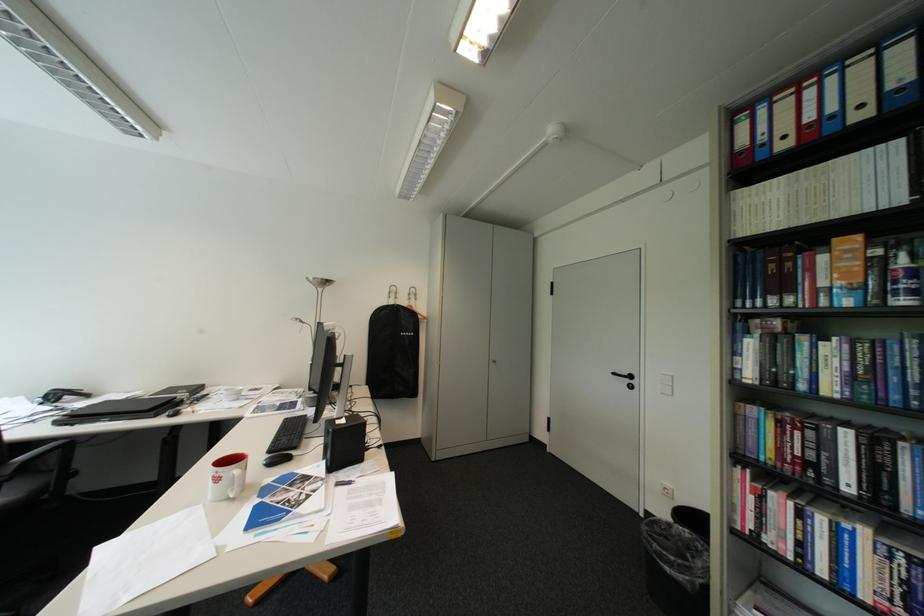
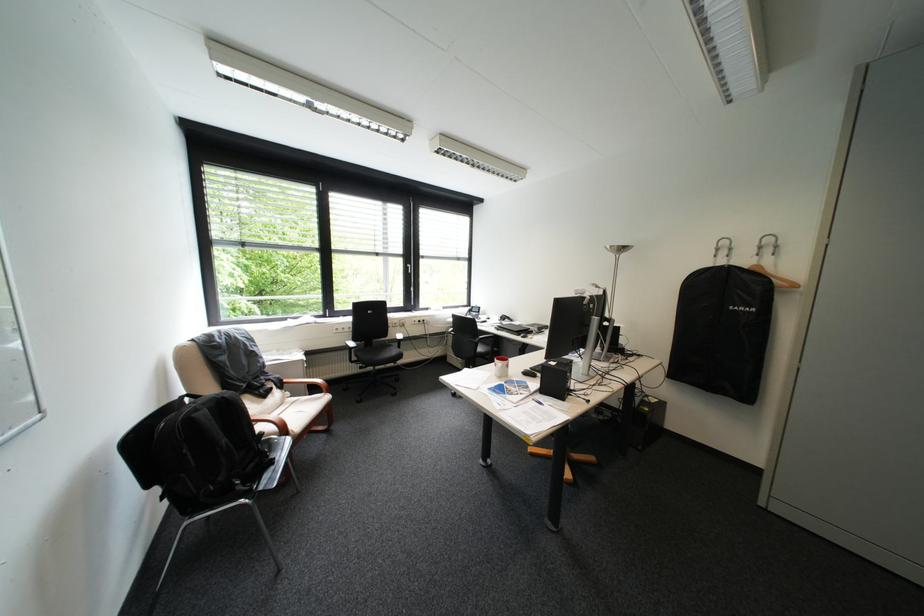
Locate, in the second image, the point that corresponds to pixel 228 480 in the first image.

(507, 365)